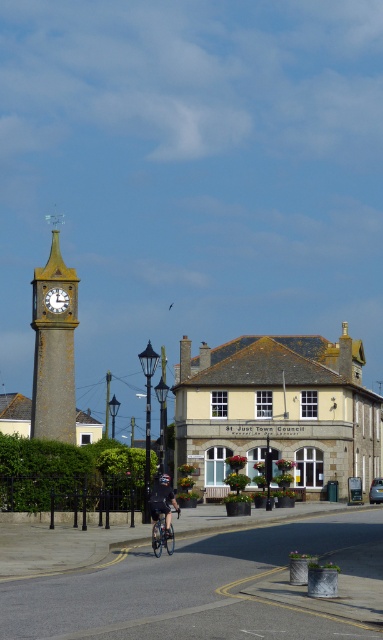
You are a photographer trying to capture both the black matte cycling suit at center and the matte gold clock at upper left in the same frame. Based on their sizes, will the cycling suit appear larger than the clock in your photo?

The black matte cycling suit at center might be wider than matte gold clock at upper left, so it could appear larger in the photo.

You are standing in the town square and want to take a photo of both the blue metallic bicycle at center and the matte gold clock at upper left. Which object should you position closer to the front of your camera frame to ensure both are in focus?

Position the blue metallic bicycle at center closer to the front of the camera frame since it is closer to the viewer than the matte gold clock at upper left. This way, both objects will be in focus as the camera can capture the depth between them effectively.

You are a tourist in the town and want to take a photo of both the stone clock tower at center and the black matte cycling suit at center. Since you can only focus on one object at a time, which one should you position closer to the camera to ensure both are in focus?

The stone clock tower at center is to the left of black matte cycling suit at center. Since they are both at the same distance from the camera, you can focus on either one and both will be in focus.